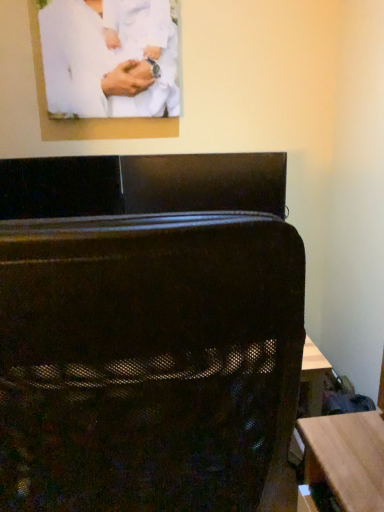
Question: Considering the relative positions of white matte clothing at upper center and black mesh suitcase at center in the image provided, is white matte clothing at upper center behind black mesh suitcase at center?

Choices:
 (A) yes
 (B) no

Answer: (A)

Question: From the image's perspective, is white matte clothing at upper center beneath black mesh suitcase at center?

Choices:
 (A) yes
 (B) no

Answer: (B)

Question: Are white matte clothing at upper center and black mesh suitcase at center far apart?

Choices:
 (A) no
 (B) yes

Answer: (A)

Question: Is white matte clothing at upper center located outside black mesh suitcase at center?

Choices:
 (A) yes
 (B) no

Answer: (A)

Question: Is white matte clothing at upper center turned away from black mesh suitcase at center?

Choices:
 (A) yes
 (B) no

Answer: (B)

Question: Is white matte clothing at upper center shorter than black mesh suitcase at center?

Choices:
 (A) yes
 (B) no

Answer: (A)

Question: Does black mesh suitcase at center have a lesser width compared to white matte clothing at upper center?

Choices:
 (A) no
 (B) yes

Answer: (A)

Question: Does black mesh suitcase at center have a smaller size compared to white matte clothing at upper center?

Choices:
 (A) no
 (B) yes

Answer: (A)

Question: Is black mesh suitcase at center aimed at white matte clothing at upper center?

Choices:
 (A) no
 (B) yes

Answer: (A)

Question: Is black mesh suitcase at center positioned with its back to white matte clothing at upper center?

Choices:
 (A) yes
 (B) no

Answer: (B)

Question: Is black mesh suitcase at center further to the viewer compared to white matte clothing at upper center?

Choices:
 (A) no
 (B) yes

Answer: (A)

Question: Can you confirm if black mesh suitcase at center is shorter than white matte clothing at upper center?

Choices:
 (A) no
 (B) yes

Answer: (A)

Question: Which is correct: black mesh suitcase at center is inside white matte clothing at upper center, or outside of it?

Choices:
 (A) inside
 (B) outside

Answer: (B)